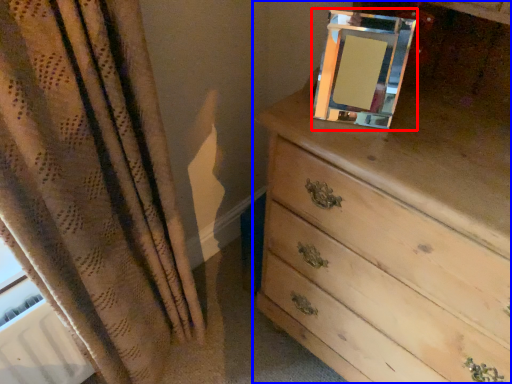
Question: Among these objects, which one is farthest to the camera, picture frame (highlighted by a red box) or chest of drawers (highlighted by a blue box)?

Choices:
 (A) picture frame
 (B) chest of drawers

Answer: (A)